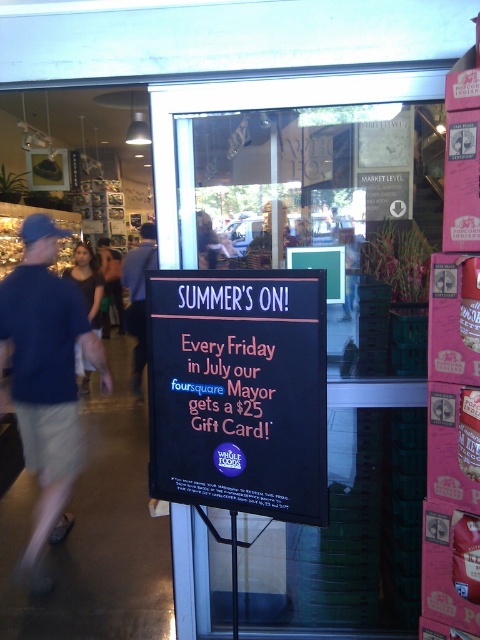
Question: Which of the following is the closest to the observer?

Choices:
 (A) (248, 356)
 (B) (137, 316)
 (C) (54, 300)

Answer: (A)

Question: Which object is positioned closest to the blue fabric shorts at lower left?

Choices:
 (A) pink neon sign at center
 (B) denim jacket at lower left

Answer: (A)

Question: Can you confirm if blue fabric shorts at lower left is positioned above denim jacket at lower left?

Choices:
 (A) no
 (B) yes

Answer: (A)

Question: Is pink neon sign at center thinner than denim jacket at lower left?

Choices:
 (A) no
 (B) yes

Answer: (B)

Question: Does black matte sign at center have a greater width compared to blue fabric shorts at lower left?

Choices:
 (A) no
 (B) yes

Answer: (A)

Question: Which object appears closest to the camera in this image?

Choices:
 (A) pink neon sign at center
 (B) black matte sign at center
 (C) denim jacket at lower left

Answer: (B)